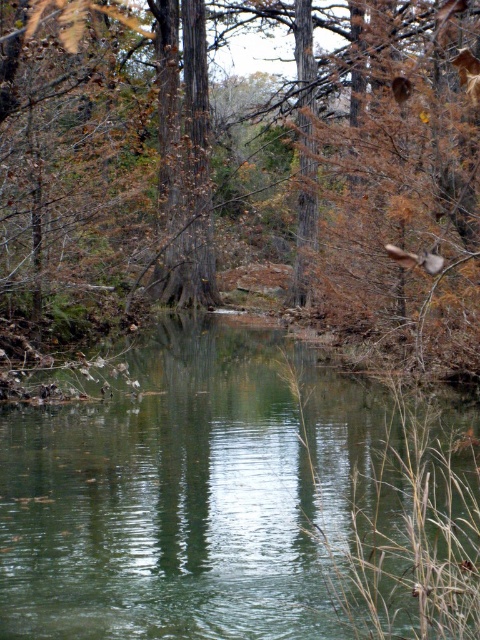
You are standing at point [213,406] and want to cross the stream to the other side. The stream is 23.25 meters wide. If your boat can carry you across up to 25 meters, will it be enough?

The stream between point [213,406] and the other side is 23.25 meters wide, so yes, the boat can carry you across since it can handle up to 25 meters.

You are a hiker standing at the brown wood tree at center. You want to cross the green smooth water at center to reach the other side. Do you think you can walk directly from the tree to the water without any obstacles?

The distance between the brown wood tree at center and the green smooth water at center is 28.09 feet, so you can walk directly from the tree to the water without any obstacles as there is no mention of obstacles in the scene description.

You are standing at the edge of the stream in the scene. There is a point marked at coordinates (239, 502) which corresponds to green smooth water at center. Can you confirm if this point is located in the center of the stream?

Yes, the point at coordinates (239, 502) marks the green smooth water at center, so it is indeed located in the center of the stream.